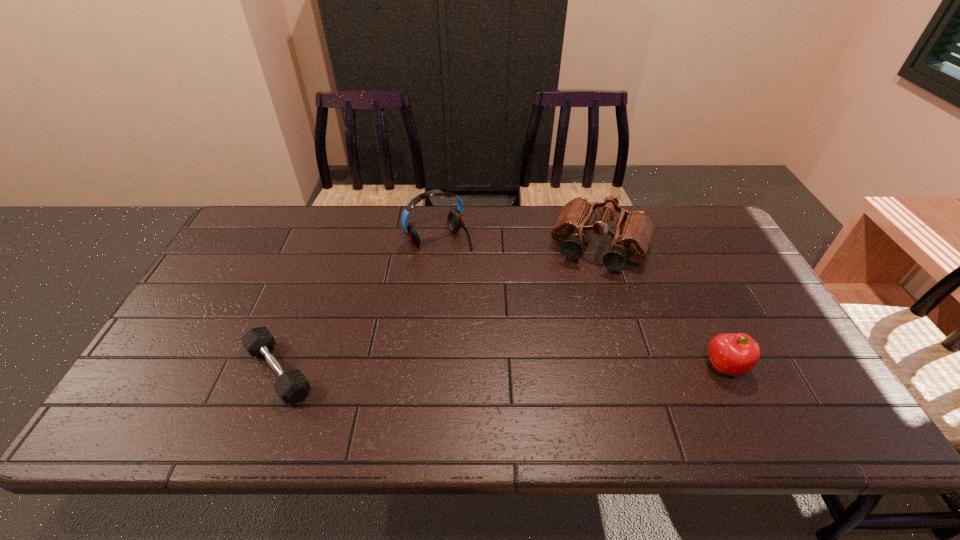
I want to click on vacant space at the far edge of the desktop, so click(412, 215).

This screenshot has height=540, width=960. In order to click on free space at the near edge of the desktop in this screenshot , I will do `click(270, 391)`.

Find the location of `vacant point at the left edge`. vacant point at the left edge is located at coordinates (211, 363).

You are a GUI agent. You are given a task and a screenshot of the screen. Output one action in this format:
    pyautogui.click(x=<x>, y=<y>)
    Task: Click on the free space at the right edge of the desktop
    The image size is (960, 540).
    Given the screenshot: What is the action you would take?
    pyautogui.click(x=783, y=358)

In the image, there is a desktop. At what (x,y) coordinates should I click in order to perform the action: click on vacant space at the far left corner. Please return your answer as a coordinate pair (x, y). Looking at the image, I should click on (252, 245).

The image size is (960, 540). Find the location of `vacant space at the near left corner of the desktop`. vacant space at the near left corner of the desktop is located at coordinates (176, 369).

What are the coordinates of `vacant region at the far right corner of the desktop` in the screenshot? It's located at 671,215.

You are a GUI agent. You are given a task and a screenshot of the screen. Output one action in this format:
    pyautogui.click(x=<x>, y=<y>)
    Task: Click on the unoccupied area between the tallest object and the shortest object
    
    Given the screenshot: What is the action you would take?
    pyautogui.click(x=359, y=305)

Locate an element on the screen. vacant area that lies between the third tallest object and the third shortest object is located at coordinates (662, 308).

Identify the location of free space between the apple and the binoculars. (662, 308).